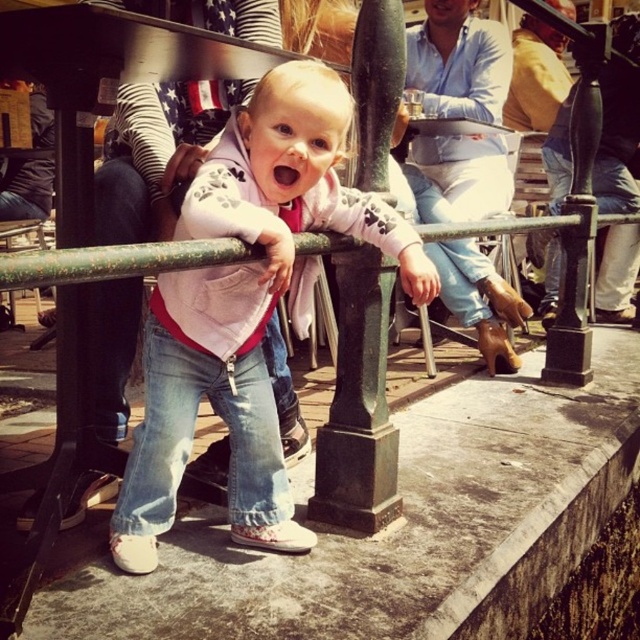
You are a tailor trying to fit a customer for a new jacket and pants. The customer is wearing a white matte jacket at center and matte blue jeans at center. Based on the image, which garment should you measure first to ensure proper fit?

The white matte jacket at center might be wider than matte blue jeans at center, so you should measure the white matte jacket at center first to ensure proper width for the jacket.

You are a photographer trying to capture the child in the scene. You notice the white matte jacket at center and the matte blue jeans at center. Which clothing item is positioned to the left of the other?

The white matte jacket at center is positioned on the left side of matte blue jeans at center.

Based on the scene description, can you determine whether the white matte jacket at center or the matte blue jeans at center takes up more visual space in the image?

The white matte jacket at center occupies less space than the matte blue jeans at center, so the matte blue jeans at center takes up more visual space.